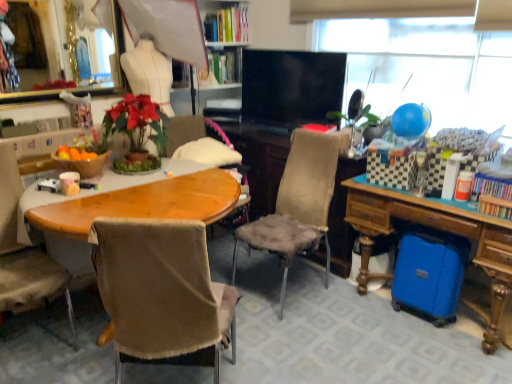
Locate an element on the screen. The height and width of the screenshot is (384, 512). vacant area situated below brown fabric chair at left, the first chair viewed from the left (from a real-world perspective) is located at coordinates (27, 332).